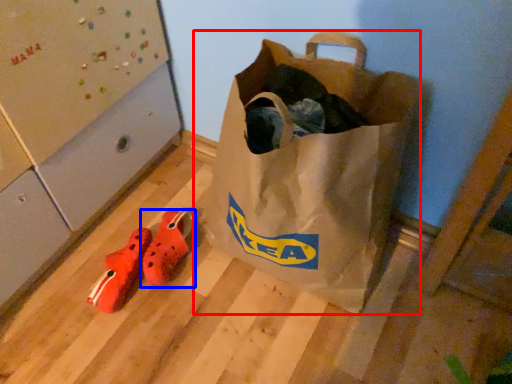
Question: Which object is further to the camera taking this photo, luggage and bags (highlighted by a red box) or footwear (highlighted by a blue box)?

Choices:
 (A) luggage and bags
 (B) footwear

Answer: (B)